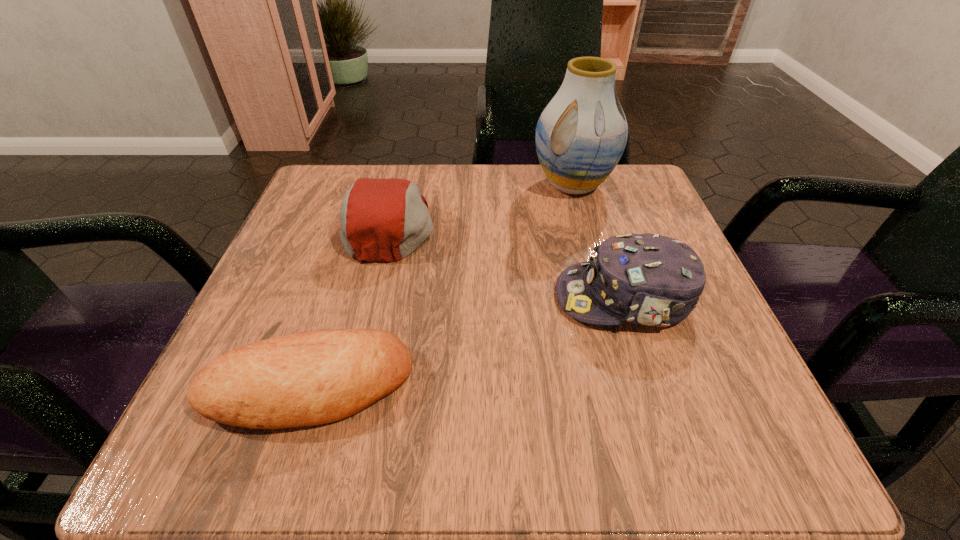
Find the location of a particular element. The width and height of the screenshot is (960, 540). object that is at the far right corner is located at coordinates (581, 134).

You are a GUI agent. You are given a task and a screenshot of the screen. Output one action in this format:
    pyautogui.click(x=<x>, y=<y>)
    Task: Click on the vacant space at the far edge of the desktop
    
    Given the screenshot: What is the action you would take?
    pyautogui.click(x=505, y=195)

The width and height of the screenshot is (960, 540). Identify the location of vacant region at the near edge of the desktop. (481, 458).

Identify the location of free space at the left edge of the desktop. (272, 264).

At what (x,y) coordinates should I click in order to perform the action: click on blank space at the right edge. Please return your answer as a coordinate pair (x, y). Looking at the image, I should click on (676, 350).

In the image, there is a desktop. At what (x,y) coordinates should I click in order to perform the action: click on blank space at the far left corner. Please return your answer as a coordinate pair (x, y). This screenshot has width=960, height=540. Looking at the image, I should click on (289, 227).

This screenshot has width=960, height=540. I want to click on blank area at the far right corner, so click(x=603, y=217).

Locate an element on the screen. The height and width of the screenshot is (540, 960). vacant space that is in between the tallest object and the left headwear is located at coordinates (481, 205).

You are a GUI agent. You are given a task and a screenshot of the screen. Output one action in this format:
    pyautogui.click(x=<x>, y=<y>)
    Task: Click on the vacant area that lies between the shortest object and the vase
    
    Given the screenshot: What is the action you would take?
    pyautogui.click(x=441, y=286)

Locate an element on the screen. Image resolution: width=960 pixels, height=540 pixels. unoccupied position between the left headwear and the nearest object is located at coordinates (349, 307).